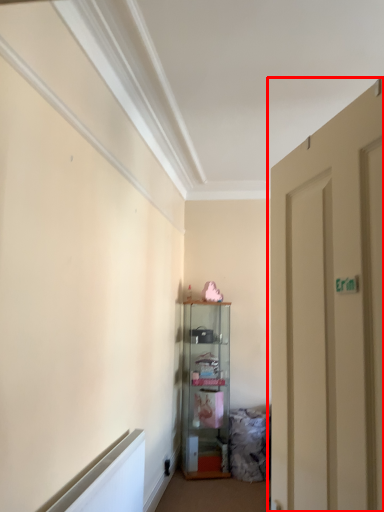
Question: From the image, what is the correct spatial relationship of door (annotated by the red box) in relation to cabinetry?

Choices:
 (A) right
 (B) left

Answer: (A)